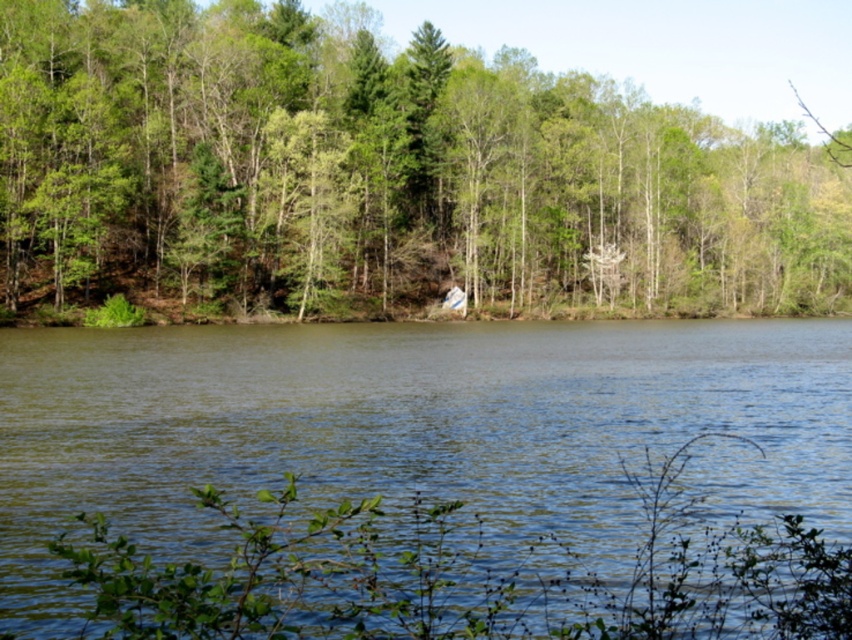
Question: Where is green leafy tree at center located in relation to greenish water at center in the image?

Choices:
 (A) right
 (B) left

Answer: (A)

Question: Is green leafy tree at center closer to the viewer compared to greenish water at center?

Choices:
 (A) yes
 (B) no

Answer: (B)

Question: Which point is farther to the camera?

Choices:
 (A) (367, 346)
 (B) (721, 282)

Answer: (B)

Question: Which point is closer to the camera?

Choices:
 (A) (442, 492)
 (B) (827, 163)

Answer: (A)

Question: Can you confirm if green leafy tree at center is smaller than greenish water at center?

Choices:
 (A) no
 (B) yes

Answer: (A)